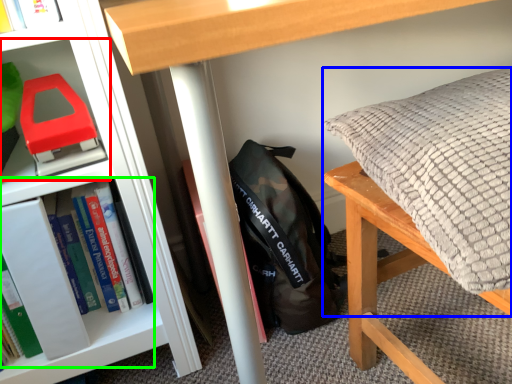
Question: Which object is the closest to the shelf (highlighted by a red box)? Choose among these: pillow (highlighted by a blue box) or book (highlighted by a green box).

Choices:
 (A) pillow
 (B) book

Answer: (B)